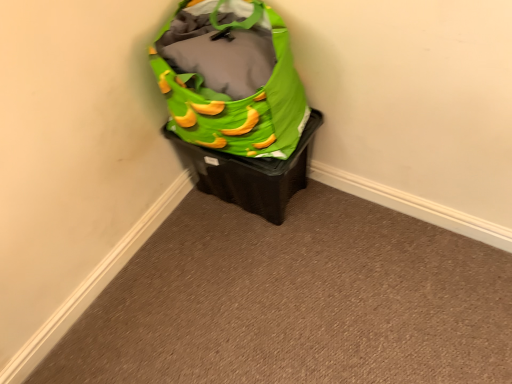
Question: Can you confirm if green fabric bag at upper center is bigger than green fabric bag at upper right?

Choices:
 (A) yes
 (B) no

Answer: (A)

Question: Is green fabric bag at upper center to the right of green fabric bag at upper right from the viewer's perspective?

Choices:
 (A) no
 (B) yes

Answer: (B)

Question: From the image's perspective, would you say green fabric bag at upper center is positioned over green fabric bag at upper right?

Choices:
 (A) no
 (B) yes

Answer: (A)

Question: Is green fabric bag at upper center beside green fabric bag at upper right?

Choices:
 (A) yes
 (B) no

Answer: (B)

Question: Could you tell me if green fabric bag at upper center is turned towards green fabric bag at upper right?

Choices:
 (A) no
 (B) yes

Answer: (A)

Question: Is green fabric bag at upper right taller or shorter than green fabric bag at upper right?

Choices:
 (A) tall
 (B) short

Answer: (A)

Question: Is green fabric bag at upper right to the left or to the right of green fabric bag at upper right in the image?

Choices:
 (A) right
 (B) left

Answer: (B)

Question: In the image, is green fabric bag at upper right positioned in front of or behind green fabric bag at upper right?

Choices:
 (A) front
 (B) behind

Answer: (A)

Question: Is green fabric bag at upper right wider or thinner than green fabric bag at upper right?

Choices:
 (A) thin
 (B) wide

Answer: (B)

Question: In terms of width, does green fabric bag at upper center look wider or thinner when compared to green fabric bag at upper right?

Choices:
 (A) wide
 (B) thin

Answer: (A)

Question: Is green fabric bag at upper center taller or shorter than green fabric bag at upper right?

Choices:
 (A) short
 (B) tall

Answer: (A)

Question: Is green fabric bag at upper center situated inside green fabric bag at upper right or outside?

Choices:
 (A) inside
 (B) outside

Answer: (B)

Question: Is green fabric bag at upper center to the left or to the right of green fabric bag at upper right in the image?

Choices:
 (A) right
 (B) left

Answer: (A)

Question: Does point (189, 56) appear closer or farther from the camera than point (468, 344)?

Choices:
 (A) farther
 (B) closer

Answer: (B)

Question: From the image's perspective, is green fabric bag at upper right positioned above or below green fabric bag at upper center?

Choices:
 (A) above
 (B) below

Answer: (A)